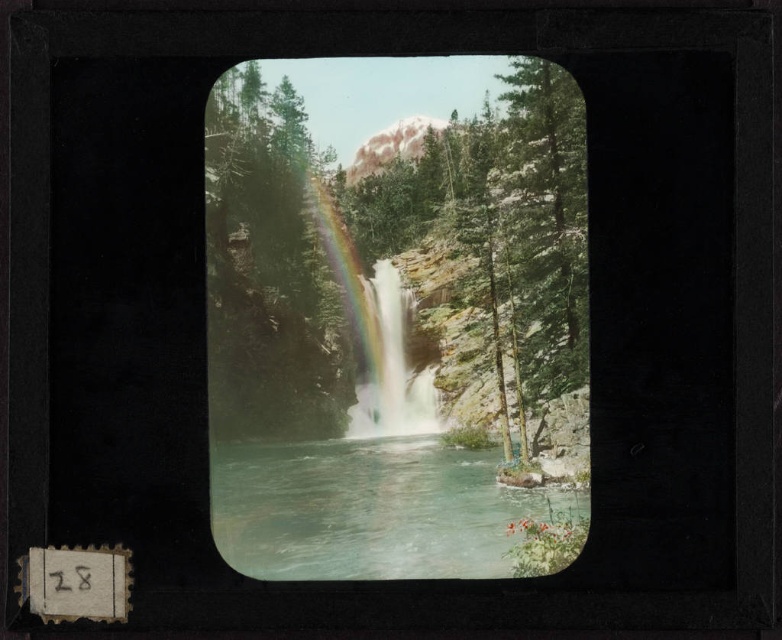
Does point (339, 460) lie behind point (350, 433)?

No.

Who is positioned more to the left, clear water at center or rainbow-colored water at center?

rainbow-colored water at center

Is point (214, 525) positioned behind point (397, 374)?

No, it is in front of (397, 374).

I want to click on clear water at center, so click(x=386, y=512).

Who is more forward, (x=465, y=193) or (x=415, y=406)?

Point (x=465, y=193)

At what (x,y) coordinates should I click in order to perform the action: click on green textured tree at center. Please return your answer as a coordinate pair (x, y). Looking at the image, I should click on (393, 240).

Between green textured tree at center and clear water at center, which one is positioned higher?

Positioned higher is green textured tree at center.

Is green textured tree at center closer to the viewer compared to clear water at center?

No.

Describe the element at coordinates (393, 240) in the screenshot. I see `green textured tree at center` at that location.

At what (x,y) coordinates should I click in order to perform the action: click on green textured tree at center. Please return your answer as a coordinate pair (x, y). The width and height of the screenshot is (782, 640). Looking at the image, I should click on (393, 240).